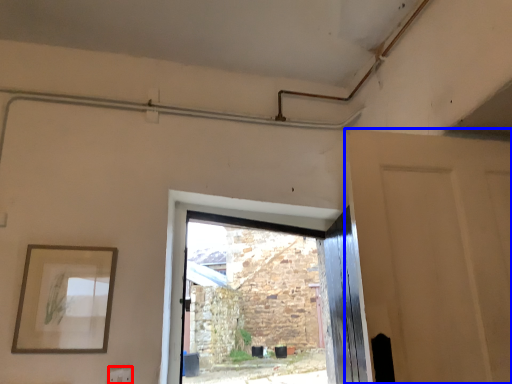
Question: Which object is further to the camera taking this photo, electric outlet (highlighted by a red box) or door (highlighted by a blue box)?

Choices:
 (A) electric outlet
 (B) door

Answer: (A)